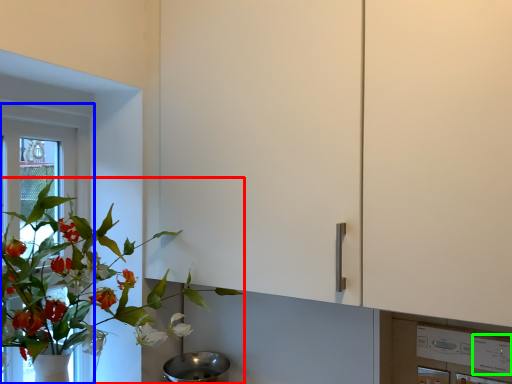
Question: Which object is positioned closest to houseplant (highlighted by a red box)? Select from window frame (highlighted by a blue box) and appliance (highlighted by a green box).

Choices:
 (A) window frame
 (B) appliance

Answer: (A)